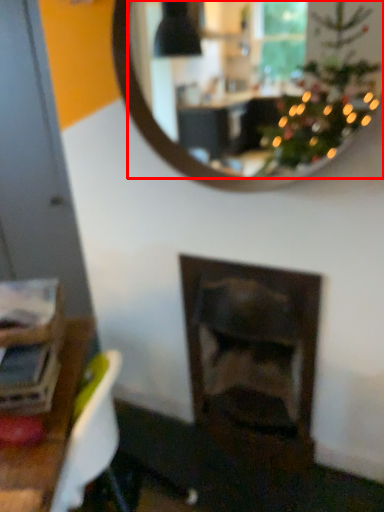
Question: Observing the image, what is the correct spatial positioning of mirror (annotated by the red box) in reference to fireplace?

Choices:
 (A) right
 (B) left

Answer: (B)